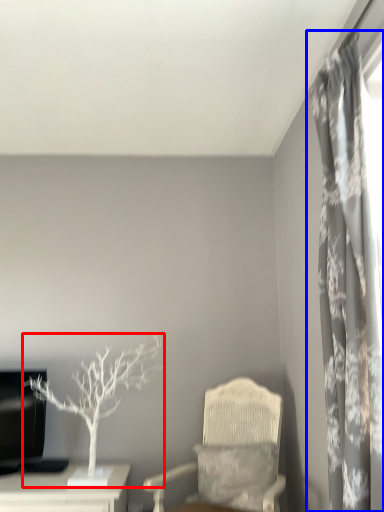
Question: Which object appears farthest to the camera in this image, houseplant (highlighted by a red box) or curtain (highlighted by a blue box)?

Choices:
 (A) houseplant
 (B) curtain

Answer: (A)